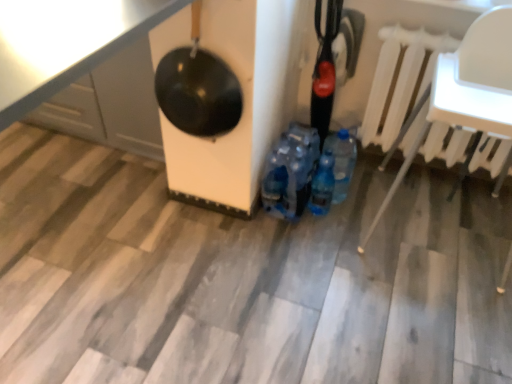
This screenshot has height=384, width=512. In order to click on vacant region in front of blue translucent bottle at center in this screenshot , I will do `click(322, 239)`.